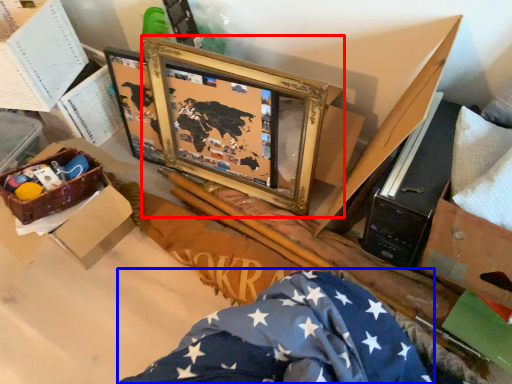
Question: Which of the following is the farthest to the observer, picture frame (highlighted by a red box) or flag (highlighted by a blue box)?

Choices:
 (A) picture frame
 (B) flag

Answer: (A)